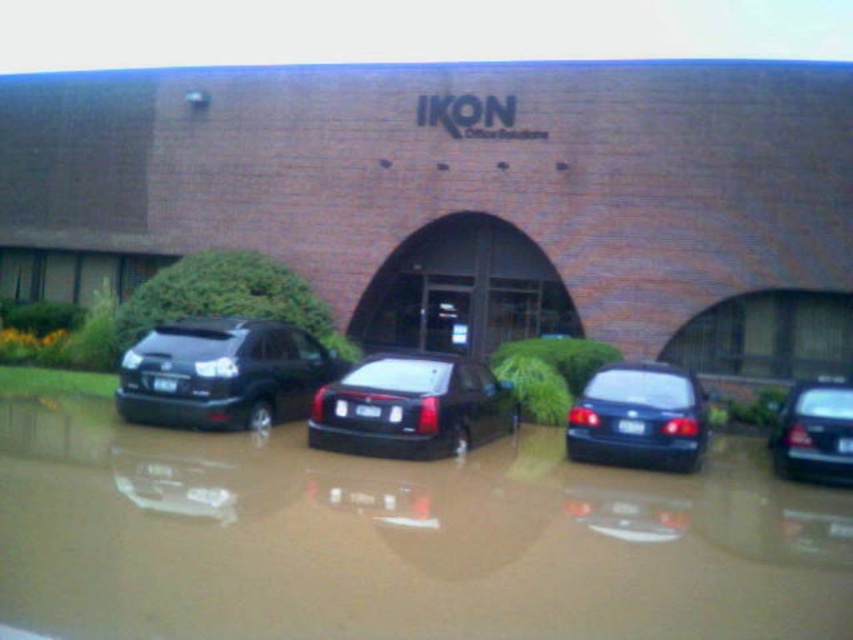
Question: Based on their relative distances, which object is farther from the glossy dark blue sedan at center?

Choices:
 (A) shiny black sedan at right
 (B) glossy black sedan at center

Answer: (B)

Question: Can you confirm if brown muddy water at lower center is positioned to the right of matte black suv at left?

Choices:
 (A) yes
 (B) no

Answer: (A)

Question: Can you confirm if matte black suv at left is positioned above glossy black sedan at center?

Choices:
 (A) yes
 (B) no

Answer: (A)

Question: Is glossy black sedan at center bigger than shiny black sedan at right?

Choices:
 (A) yes
 (B) no

Answer: (A)

Question: Which point is closer to the camera taking this photo?

Choices:
 (A) (653, 374)
 (B) (798, 435)
 (C) (433, 547)
 (D) (326, 408)

Answer: (C)

Question: Which point is closer to the camera?

Choices:
 (A) glossy black sedan at center
 (B) shiny black sedan at right
 (C) brown muddy water at lower center
 (D) glossy dark blue sedan at center

Answer: (C)